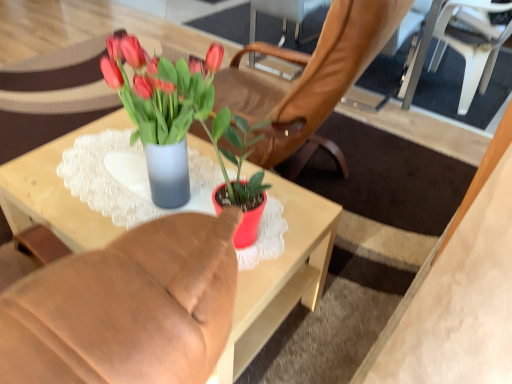
Question: Is matte glass vase at center to the left of white plastic chair at upper right from the viewer's perspective?

Choices:
 (A) no
 (B) yes

Answer: (B)

Question: Is white plastic chair at upper right at the back of matte glass vase at center?

Choices:
 (A) no
 (B) yes

Answer: (A)

Question: Is white plastic chair at upper right located within matte glass vase at center?

Choices:
 (A) yes
 (B) no

Answer: (B)

Question: Does matte glass vase at center have a lesser width compared to white plastic chair at upper right?

Choices:
 (A) no
 (B) yes

Answer: (A)

Question: From the image's perspective, would you say matte glass vase at center is positioned over white plastic chair at upper right?

Choices:
 (A) yes
 (B) no

Answer: (B)

Question: Is matte glass vase at center wider than white plastic chair at upper right?

Choices:
 (A) yes
 (B) no

Answer: (A)

Question: Considering the relative positions of white plastic chair at upper right and matte glass vase at center in the image provided, is white plastic chair at upper right behind matte glass vase at center?

Choices:
 (A) no
 (B) yes

Answer: (B)

Question: Are white plastic chair at upper right and matte glass vase at center making contact?

Choices:
 (A) no
 (B) yes

Answer: (A)

Question: Is matte glass vase at center at the back of white plastic chair at upper right?

Choices:
 (A) no
 (B) yes

Answer: (A)

Question: Can you confirm if white plastic chair at upper right is thinner than matte glass vase at center?

Choices:
 (A) yes
 (B) no

Answer: (A)

Question: From a real-world perspective, is white plastic chair at upper right physically below matte glass vase at center?

Choices:
 (A) yes
 (B) no

Answer: (B)

Question: Does white plastic chair at upper right contain matte glass vase at center?

Choices:
 (A) yes
 (B) no

Answer: (B)

Question: Is matte glass vase at center inside the boundaries of white plastic chair at upper right, or outside?

Choices:
 (A) inside
 (B) outside

Answer: (B)